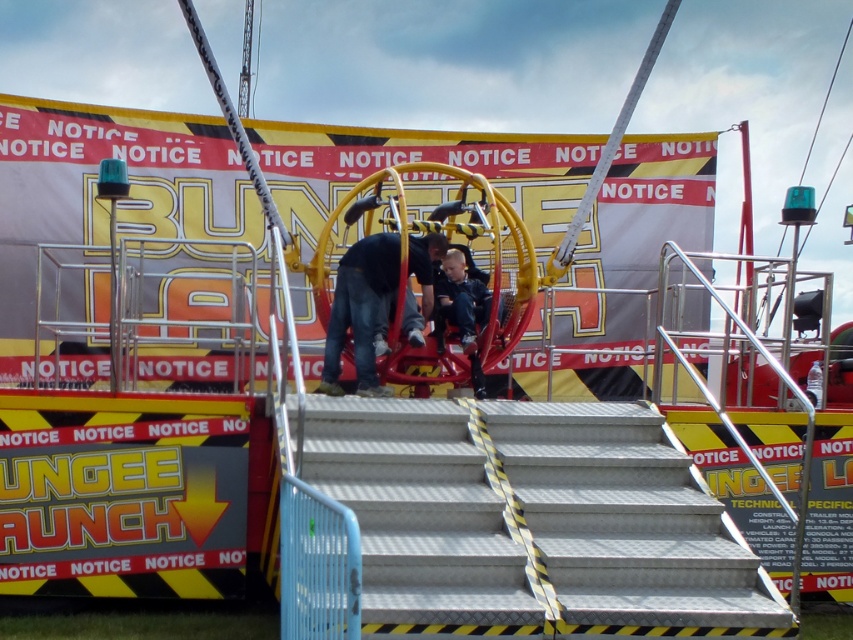
Question: Is metallic/stainless steel stairs at center closer to the viewer compared to denim jeans at center?

Choices:
 (A) yes
 (B) no

Answer: (A)

Question: Based on their relative distances, which object is farther from the metallic/stainless steel stairs at center?

Choices:
 (A) dark blue jeans at center
 (B) denim jeans at center

Answer: (A)

Question: Does denim jeans at center appear on the right side of dark blue jeans at center?

Choices:
 (A) yes
 (B) no

Answer: (B)

Question: Among these objects, which one is farthest from the camera?

Choices:
 (A) denim jeans at center
 (B) metallic/stainless steel stairs at center
 (C) dark blue jeans at center

Answer: (C)

Question: Based on their relative distances, which object is farther from the metallic/stainless steel stairs at center?

Choices:
 (A) dark blue jeans at center
 (B) denim jeans at center

Answer: (A)

Question: Can you confirm if denim jeans at center is positioned above dark blue jeans at center?

Choices:
 (A) no
 (B) yes

Answer: (A)